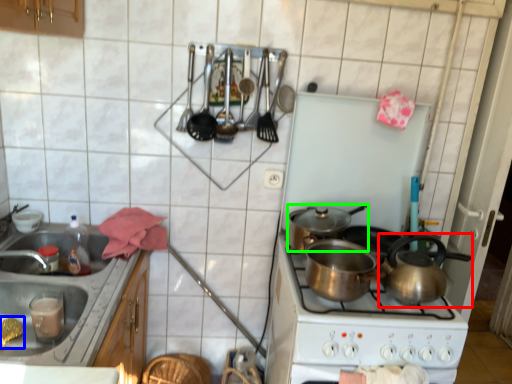
Question: Considering the real-world distances, which object is farthest from tea pot (highlighted by a red box)? food (highlighted by a blue box) or kitchen appliance (highlighted by a green box)?

Choices:
 (A) food
 (B) kitchen appliance

Answer: (A)